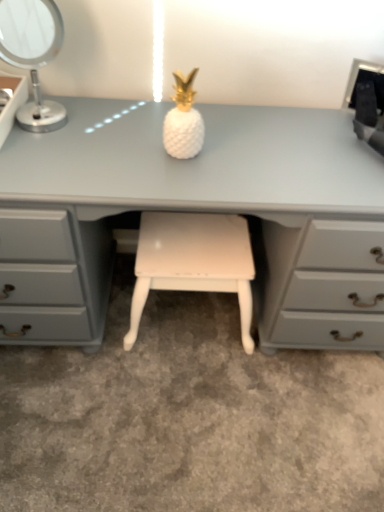
Where is `free space in front of silver metallic table lamp at upper left`? free space in front of silver metallic table lamp at upper left is located at coordinates (42, 156).